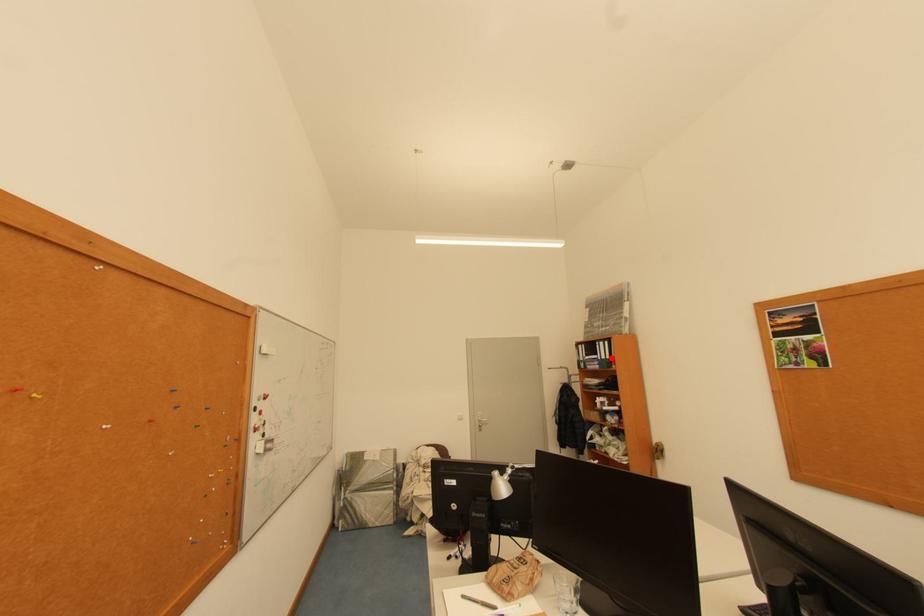
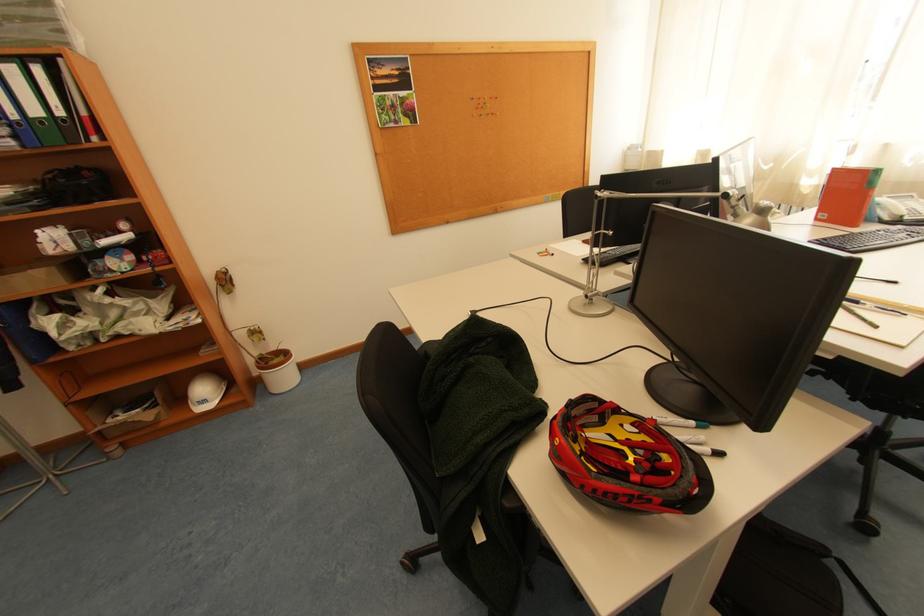
In the second image, find the point that corresponds to the highlighted location in the first image.

(44, 113)